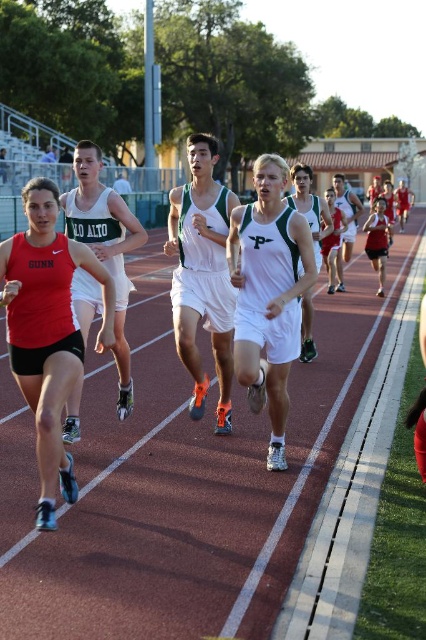
Question: Does matte red tank top at left appear under white/green athletic uniform at center?

Choices:
 (A) no
 (B) yes

Answer: (B)

Question: Does white matte tank top at center have a lesser width compared to matte red tank top at center?

Choices:
 (A) no
 (B) yes

Answer: (B)

Question: Among these objects, which one is farthest from the camera?

Choices:
 (A) white athletic uniform at center
 (B) matte red tank top at center
 (C) white matte shorts at center
 (D) white/green athletic uniform at center

Answer: (B)

Question: Which object is positioned closest to the white matte shorts at center?

Choices:
 (A) white athletic uniform at center
 (B) matte red tank top at center

Answer: (A)

Question: Which object is the farthest from the white matte shorts at center?

Choices:
 (A) white matte tank top at center
 (B) matte red tank top at center
 (C) white/green athletic uniform at center

Answer: (B)

Question: Is white matte shorts at center to the left of matte red tank top at center from the viewer's perspective?

Choices:
 (A) no
 (B) yes

Answer: (B)